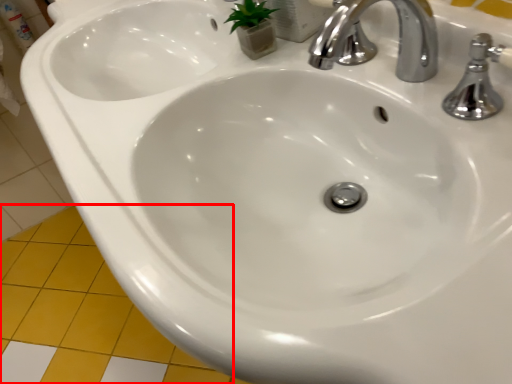
Question: Where is ceramic tile (annotated by the red box) located in relation to tap in the image?

Choices:
 (A) right
 (B) left

Answer: (B)